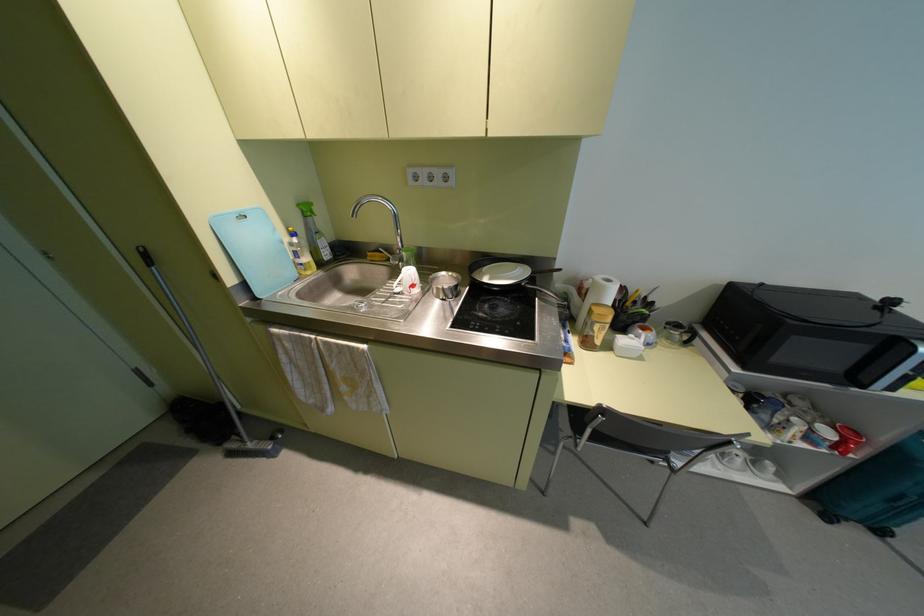
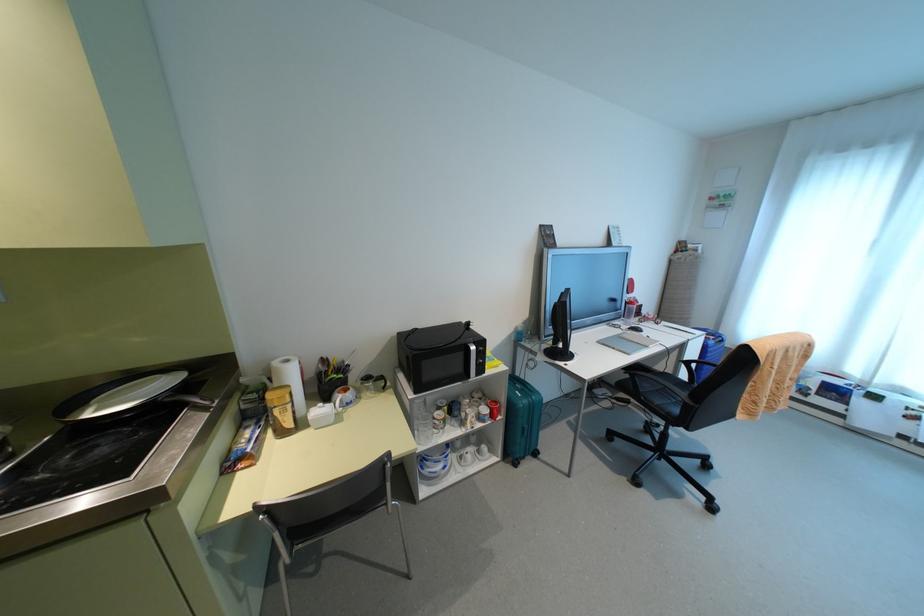
Where in the second image is the point corresponding to the point at 622,339 from the first image?

(317, 411)